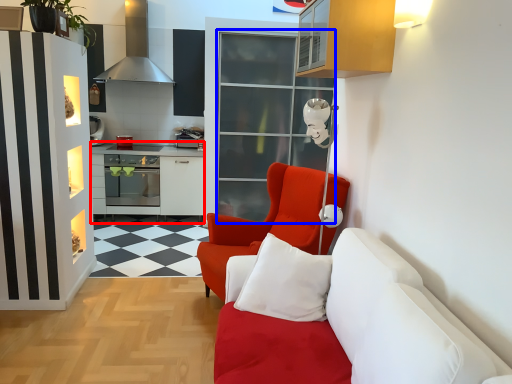
Question: Which point is closer to the camera, table (highlighted by a red box) or glass door (highlighted by a blue box)?

Choices:
 (A) table
 (B) glass door

Answer: (B)